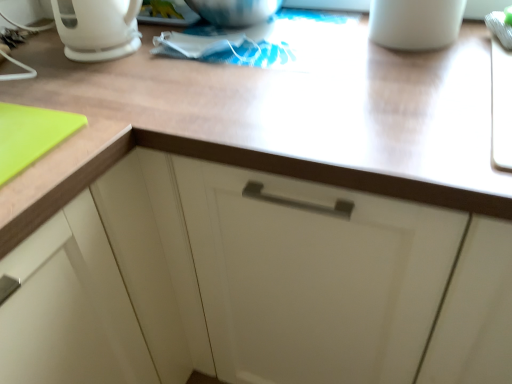
Where is `vacant region to the left of white glossy coffee pot at upper left`? This screenshot has height=384, width=512. vacant region to the left of white glossy coffee pot at upper left is located at coordinates (44, 53).